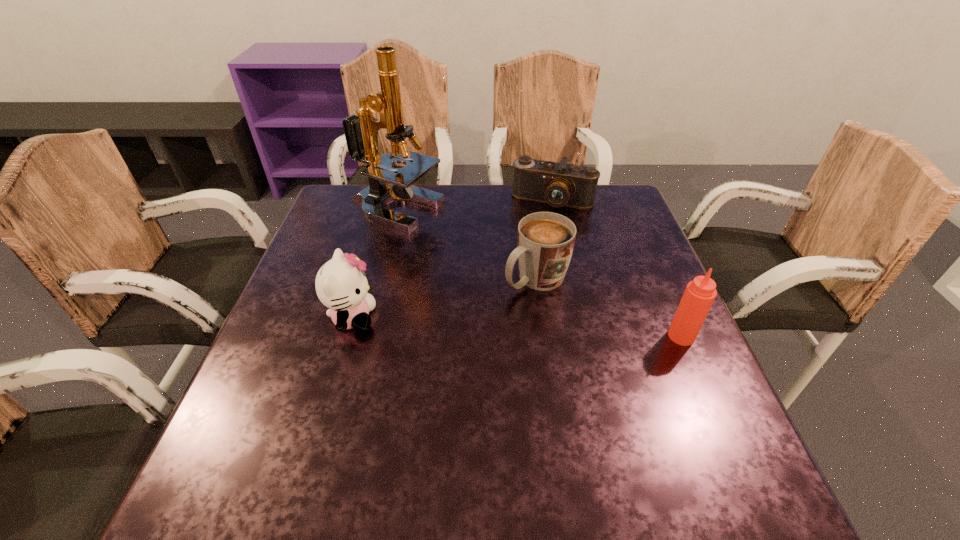
Locate an element on the screen. The width and height of the screenshot is (960, 540). vacant area situated 0.080m at the eyepiece of the microscope is located at coordinates (439, 243).

Locate an element on the screen. vacant space situated at the eyepiece of the microscope is located at coordinates (450, 252).

Where is `free spot located at the eyepiece of the microscope`? Image resolution: width=960 pixels, height=540 pixels. free spot located at the eyepiece of the microscope is located at coordinates (512, 305).

Locate an element on the screen. This screenshot has width=960, height=540. vacant region located on the lens of the camera is located at coordinates (522, 275).

This screenshot has width=960, height=540. I want to click on free location located on the lens of the camera, so click(x=516, y=294).

In order to click on free region located 0.120m on the lens of the camera in this screenshot , I will do `click(535, 240)`.

The image size is (960, 540). What are the coordinates of `microscope that is at the far edge` in the screenshot? It's located at (361, 132).

Locate an element on the screen. The height and width of the screenshot is (540, 960). camera that is at the far edge is located at coordinates (560, 184).

Where is `kitten present at the left edge`? kitten present at the left edge is located at coordinates (341, 285).

The height and width of the screenshot is (540, 960). I want to click on microscope at the left edge, so 361,132.